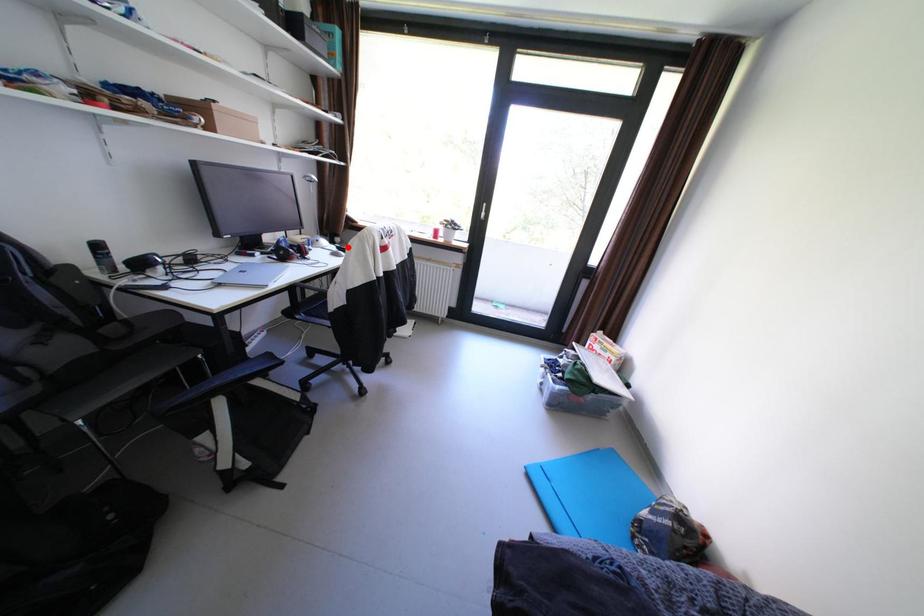
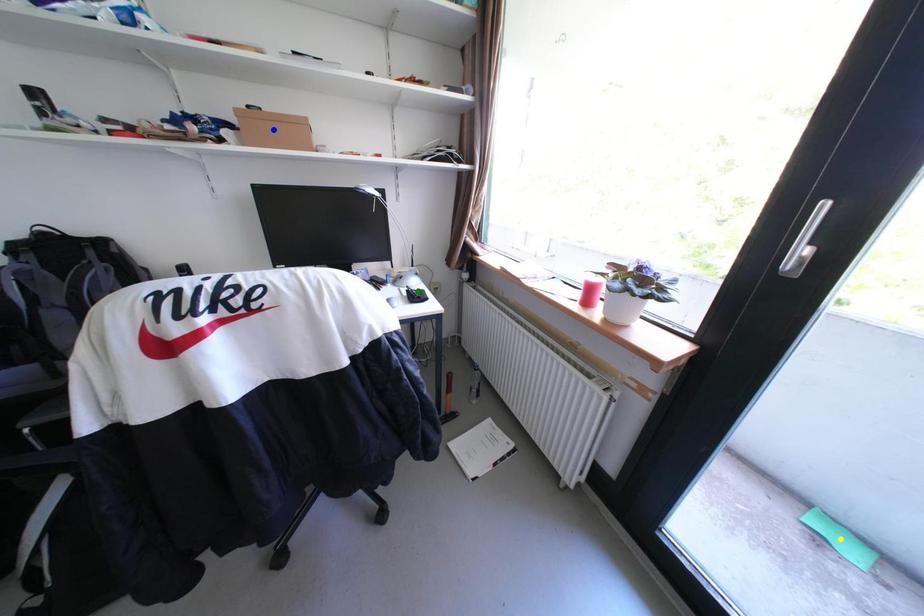
Question: I am providing you with two images of the same scene from different viewpoints. A red point is marked on the first image. You are given multiple points on the second image. Which spot in image 2 lines up with the point in image 1?

Choices:
 (A) green point
 (B) yellow point
 (C) blue point

Answer: (A)